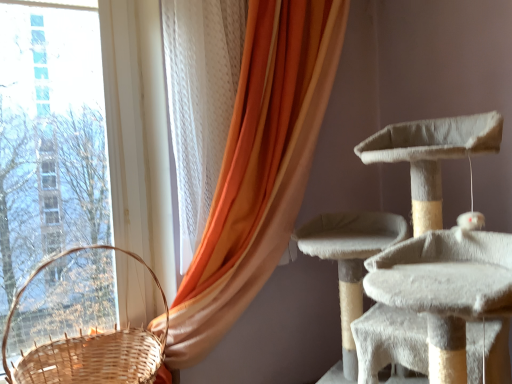
Identify the location of orange fabric curtain at left. This screenshot has height=384, width=512. (259, 167).

The height and width of the screenshot is (384, 512). What do you see at coordinates (259, 167) in the screenshot?
I see `orange fabric curtain at left` at bounding box center [259, 167].

The width and height of the screenshot is (512, 384). Describe the element at coordinates (90, 347) in the screenshot. I see `woven wood basket at left` at that location.

What are the coordinates of `woven wood basket at left` in the screenshot? It's located at (90, 347).

Image resolution: width=512 pixels, height=384 pixels. I want to click on orange fabric curtain at left, so click(x=259, y=167).

Visually, is woven wood basket at left positioned to the left or to the right of orange fabric curtain at left?

Based on their positions, woven wood basket at left is located to the left of orange fabric curtain at left.

Considering the positions of objects woven wood basket at left and orange fabric curtain at left in the image provided, who is in front, woven wood basket at left or orange fabric curtain at left?

woven wood basket at left is more forward.

Is point (113, 373) closer or farther from the camera than point (252, 180)?

Point (113, 373) is farther from the camera than point (252, 180).

From the image's perspective, between woven wood basket at left and orange fabric curtain at left, which one is located above?

From the image's view, orange fabric curtain at left is above.

From a real-world perspective, is woven wood basket at left on top of orange fabric curtain at left?

A: Incorrect, from a real-world perspective, woven wood basket at left is lower than orange fabric curtain at left.

Considering the sizes of objects woven wood basket at left and orange fabric curtain at left in the image provided, who is thinner, woven wood basket at left or orange fabric curtain at left?

orange fabric curtain at left is thinner.

Who is shorter, woven wood basket at left or orange fabric curtain at left?

With less height is woven wood basket at left.

Is woven wood basket at left bigger than orange fabric curtain at left?

Incorrect, woven wood basket at left is not larger than orange fabric curtain at left.

Is orange fabric curtain at left located within woven wood basket at left?

That's incorrect, orange fabric curtain at left is not inside woven wood basket at left.

Is woven wood basket at left next to orange fabric curtain at left?

No.

Could you tell me if woven wood basket at left is turned towards orange fabric curtain at left?

No, woven wood basket at left is not turned towards orange fabric curtain at left.

Locate an element on the screen. The width and height of the screenshot is (512, 384). basket directly beneath the orange fabric curtain at left (from a real-world perspective) is located at coordinates (90, 347).

Looking at this image, in the image, is orange fabric curtain at left on the left side or the right side of woven wood basket at left?

In the image, orange fabric curtain at left appears on the right side of woven wood basket at left.

Which object is further away from the camera, orange fabric curtain at left or woven wood basket at left?

orange fabric curtain at left is further away from the camera.

Is point (297, 156) in front of point (33, 372)?

No, it is not.

From the image's perspective, which is below, orange fabric curtain at left or woven wood basket at left?

From the image's view, woven wood basket at left is below.

From a real-world perspective, is orange fabric curtain at left positioned above or below woven wood basket at left?

From a real-world perspective, orange fabric curtain at left is physically above woven wood basket at left.

Does orange fabric curtain at left have a greater width compared to woven wood basket at left?

A: No.

Which of these two, orange fabric curtain at left or woven wood basket at left, stands shorter?

woven wood basket at left.

Considering the sizes of objects orange fabric curtain at left and woven wood basket at left in the image provided, who is smaller, orange fabric curtain at left or woven wood basket at left?

woven wood basket at left is smaller.

Can we say orange fabric curtain at left lies outside woven wood basket at left?

Absolutely, orange fabric curtain at left is external to woven wood basket at left.

Is orange fabric curtain at left next to woven wood basket at left and touching it?

orange fabric curtain at left and woven wood basket at left are not in contact.

Consider the image. Is orange fabric curtain at left looking in the opposite direction of woven wood basket at left?

orange fabric curtain at left does not have its back to woven wood basket at left.

Can you tell me how much orange fabric curtain at left and woven wood basket at left differ in facing direction?

There is a 0.00013-degree angle between the facing directions of orange fabric curtain at left and woven wood basket at left.

The image size is (512, 384). Find the location of `curtain located on the right of woven wood basket at left`. curtain located on the right of woven wood basket at left is located at coordinates (259, 167).

Where is `basket lying below the orange fabric curtain at left (from the image's perspective)`? basket lying below the orange fabric curtain at left (from the image's perspective) is located at coordinates (90, 347).

Locate an element on the screen. This screenshot has height=384, width=512. basket in front of the orange fabric curtain at left is located at coordinates coord(90,347).